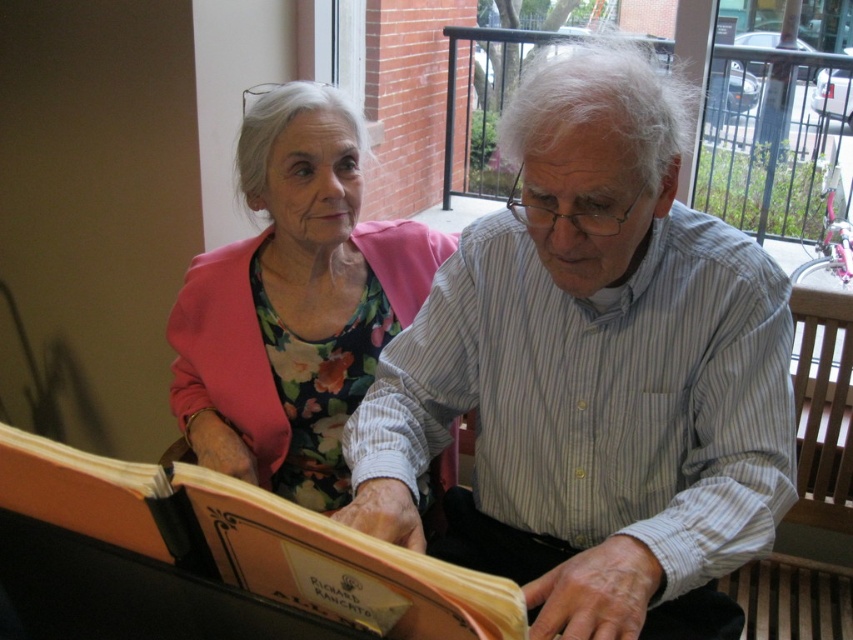
Does floral fabric dress at upper left lie behind smooth fabric lap at center?

That is True.

Can you confirm if floral fabric dress at upper left is positioned below smooth fabric lap at center?

Actually, floral fabric dress at upper left is above smooth fabric lap at center.

Identify the location of floral fabric dress at upper left. This screenshot has width=853, height=640. (294, 301).

Is white striped shirt at center above smooth fabric lap at center?

Indeed, white striped shirt at center is positioned over smooth fabric lap at center.

Is point (756, 419) positioned behind point (482, 557)?

That is False.

Find the location of a particular element. The width and height of the screenshot is (853, 640). white striped shirt at center is located at coordinates (593, 374).

Can you confirm if floral fabric dress at upper left is positioned below orange paper book at center?

No.

Is floral fabric dress at upper left to the left of orange paper book at center from the viewer's perspective?

Yes, floral fabric dress at upper left is to the left of orange paper book at center.

Is point (340, 104) less distant than point (151, 550)?

No, (340, 104) is further to viewer.

Where is `floral fabric dress at upper left`? The width and height of the screenshot is (853, 640). floral fabric dress at upper left is located at coordinates (294, 301).